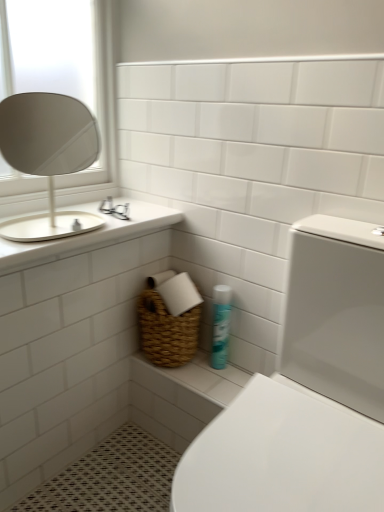
Describe the element at coordinates (191, 380) in the screenshot. This screenshot has width=384, height=512. I see `woven basket at lower center` at that location.

Identify the location of white ceramic sink at upper left. (75, 232).

The image size is (384, 512). What do you see at coordinates (220, 325) in the screenshot?
I see `blue glossy spray can at lower center` at bounding box center [220, 325].

I want to click on woven basket at lower center, so click(191, 380).

Between blue glossy spray can at lower center and woven basket at lower center, which one has smaller size?

blue glossy spray can at lower center is smaller.

How many degrees apart are the facing directions of blue glossy spray can at lower center and woven basket at lower center?

The angular difference between blue glossy spray can at lower center and woven basket at lower center is 0.552 degrees.

Which of these two, blue glossy spray can at lower center or woven basket at lower center, is wider?

With larger width is woven basket at lower center.

Which is behind, blue glossy spray can at lower center or woven basket at lower center?

blue glossy spray can at lower center is behind.

Who is taller, white glossy toilet at lower right or white glossy countertop at upper left?

Standing taller between the two is white glossy toilet at lower right.

From a real-world perspective, does white glossy toilet at lower right sit lower than white glossy countertop at upper left?

Correct, in the physical world, white glossy toilet at lower right is lower than white glossy countertop at upper left.

Image resolution: width=384 pixels, height=512 pixels. In order to click on counter top on the left of the white glossy toilet at lower right in this screenshot , I will do `click(88, 234)`.

Could white glossy countertop at upper left be considered to be inside white glossy toilet at lower right?

That's incorrect, white glossy countertop at upper left is not inside white glossy toilet at lower right.

Is blue glossy spray can at lower center spatially inside white ceramic sink at upper left, or outside of it?

The correct answer is: outside.

Find the location of `cleaning product below the white ceramic sink at upper left (from a real-world perspective)`. cleaning product below the white ceramic sink at upper left (from a real-world perspective) is located at coordinates (220, 325).

How different are the orientations of blue glossy spray can at lower center and white ceramic sink at upper left in degrees?

86.6 degrees.

From the picture: Considering the relative positions of blue glossy spray can at lower center and white ceramic sink at upper left in the image provided, is blue glossy spray can at lower center to the left of white ceramic sink at upper left from the viewer's perspective?

In fact, blue glossy spray can at lower center is to the right of white ceramic sink at upper left.

From the image's perspective, is woven basket at lower center located above or below white ceramic sink at upper left?

woven basket at lower center is below white ceramic sink at upper left.

How distant is woven basket at lower center from white ceramic sink at upper left?

woven basket at lower center and white ceramic sink at upper left are 96.42 centimeters apart from each other.

Is woven basket at lower center facing towards white ceramic sink at upper left?

Result: No.

Do you think woven basket at lower center is within white ceramic sink at upper left, or outside of it?

woven basket at lower center is not enclosed by white ceramic sink at upper left.

Does white glossy countertop at upper left have a lesser height compared to blue glossy spray can at lower center?

Indeed, white glossy countertop at upper left has a lesser height compared to blue glossy spray can at lower center.

In order to click on counter top that is above the blue glossy spray can at lower center (from the image's perspective) in this screenshot , I will do `click(88, 234)`.

From a real-world perspective, between white glossy countertop at upper left and blue glossy spray can at lower center, who is vertically higher?

white glossy countertop at upper left is physically above.

Consider the image. Considering the relative sizes of white glossy countertop at upper left and blue glossy spray can at lower center in the image provided, is white glossy countertop at upper left bigger than blue glossy spray can at lower center?

Yes.

Can you confirm if white glossy countertop at upper left is bigger than woven basket at lower center?

Correct, white glossy countertop at upper left is larger in size than woven basket at lower center.

Considering the relative positions of white glossy countertop at upper left and woven basket at lower center in the image provided, is white glossy countertop at upper left to the left or to the right of woven basket at lower center?

Clearly, white glossy countertop at upper left is on the left of woven basket at lower center in the image.

Can you confirm if white glossy countertop at upper left is wider than woven basket at lower center?

Indeed, white glossy countertop at upper left has a greater width compared to woven basket at lower center.

How different are the orientations of white glossy countertop at upper left and woven basket at lower center in degrees?

88.1 degrees separate the facing orientations of white glossy countertop at upper left and woven basket at lower center.

Can we say blue glossy spray can at lower center lies outside white glossy toilet at lower right?

That's correct, blue glossy spray can at lower center is outside of white glossy toilet at lower right.

From a real-world perspective, is blue glossy spray can at lower center physically above white glossy toilet at lower right?

No, from a real-world perspective, blue glossy spray can at lower center is not on top of white glossy toilet at lower right.

Is blue glossy spray can at lower center not near white glossy toilet at lower right?

No, blue glossy spray can at lower center is in close proximity to white glossy toilet at lower right.

How many degrees apart are the facing directions of blue glossy spray can at lower center and white glossy toilet at lower right?

The angular difference between blue glossy spray can at lower center and white glossy toilet at lower right is 4.1 degrees.

Image resolution: width=384 pixels, height=512 pixels. I want to click on ledge below the blue glossy spray can at lower center (from a real-world perspective), so click(x=191, y=380).

Locate an element on the screen. toilet below the white glossy countertop at upper left (from the image's perspective) is located at coordinates (306, 392).

Considering their positions, is white ceramic sink at upper left positioned further to white glossy toilet at lower right than woven basket at lower center?

white ceramic sink at upper left lies further to white glossy toilet at lower right than the other object.

Looking at the image, which one is located closer to white glossy countertop at upper left, white glossy toilet at lower right or white ceramic sink at upper left?

white ceramic sink at upper left is closer to white glossy countertop at upper left.

Based on their spatial positions, is blue glossy spray can at lower center or woven basket at lower center closer to white glossy countertop at upper left?

Among the two, blue glossy spray can at lower center is located nearer to white glossy countertop at upper left.

Based on their spatial positions, is blue glossy spray can at lower center or white glossy countertop at upper left further from white ceramic sink at upper left?

blue glossy spray can at lower center.

When comparing their distances from blue glossy spray can at lower center, does white glossy countertop at upper left or white glossy toilet at lower right seem further?

white glossy toilet at lower right is further to blue glossy spray can at lower center.

Looking at the image, which one is located closer to white glossy countertop at upper left, woven basket at lower center or white ceramic sink at upper left?

Based on the image, woven basket at lower center appears to be nearer to white glossy countertop at upper left.

Estimate the real-world distances between objects in this image. Which object is closer to woven basket at lower center, blue glossy spray can at lower center or white glossy toilet at lower right?

blue glossy spray can at lower center lies closer to woven basket at lower center than the other object.

When comparing their distances from blue glossy spray can at lower center, does woven basket at lower center or white glossy countertop at upper left seem further?

The object further to blue glossy spray can at lower center is white glossy countertop at upper left.

Image resolution: width=384 pixels, height=512 pixels. I want to click on cleaning product between white ceramic sink at upper left and woven basket at lower center in the vertical direction, so click(220, 325).

Where is `counter top between white ceramic sink at upper left and blue glossy spray can at lower center in the horizontal direction`? The height and width of the screenshot is (512, 384). counter top between white ceramic sink at upper left and blue glossy spray can at lower center in the horizontal direction is located at coordinates (88, 234).

You are a GUI agent. You are given a task and a screenshot of the screen. Output one action in this format:
    pyautogui.click(x=<x>, y=<y>)
    Task: Click on the counter top located between white ceramic sink at upper left and white glossy toilet at lower right in the left-right direction
    Image resolution: width=384 pixels, height=512 pixels.
    Given the screenshot: What is the action you would take?
    pyautogui.click(x=88, y=234)

At what (x,y) coordinates should I click in order to perform the action: click on sink between white glossy toilet at lower right and woven basket at lower center along the z-axis. Please return your answer as a coordinate pair (x, y). Image resolution: width=384 pixels, height=512 pixels. Looking at the image, I should click on (75, 232).